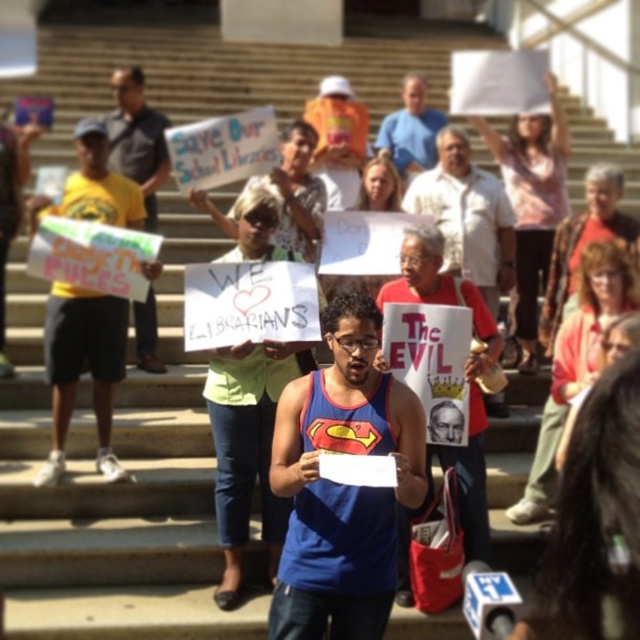
Question: Which of the following is the farthest from the observer?

Choices:
 (A) matte blue tank top at center
 (B) blue fabric tank top at center
 (C) red fabric sign at center

Answer: (C)

Question: Does matte blue tank top at center have a larger size compared to red fabric sign at center?

Choices:
 (A) no
 (B) yes

Answer: (B)

Question: Which point appears closest to the camera in this image?

Choices:
 (A) (109, 150)
 (B) (465, 522)
 (C) (442, 218)
 (D) (397, 125)

Answer: (B)

Question: Based on their relative distances, which object is nearer to the yellow t-shirt at left?

Choices:
 (A) matte blue tank top at center
 (B) blue t-shirt at center
 (C) yellow cotton shirt at left

Answer: (C)

Question: Can you confirm if yellow cotton shirt at left is positioned below red fabric sign at center?

Choices:
 (A) yes
 (B) no

Answer: (A)

Question: Is yellow cotton shirt at left bigger than red fabric sign at center?

Choices:
 (A) no
 (B) yes

Answer: (A)